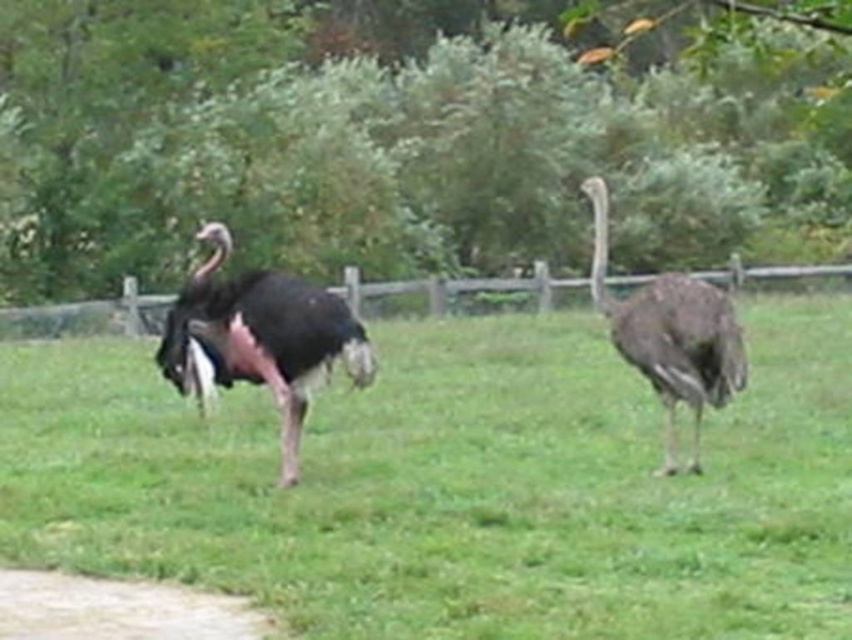
You are an ostrich keeper who needs to walk from the dirt path at lower left to the wooden fence at center. Which path should you take to avoid walking through the enclosure where the ostriches are roaming?

The dirt path at lower left is smaller than the wooden fence at center. To avoid walking through the enclosure, you should take the wooden fence at center as it is larger and likely the designated path for keepers.

You are standing in front of the enclosure with the two ostriches. There are two points marked in the image. You need to determine which point is closer to you. The points are point 1 at coordinates point (104, 580) and point 2 at coordinates point (767, 269). Which point is closer to you?

Point 1 at coordinates point (104, 580) is closer to the viewer than point 2 at coordinates point (767, 269).

You are an ostrich in the enclosure and want to walk to the dirt path at lower left. Which direction should you move from the green grassy at center to reach it?

The dirt path at lower left is located to the left side of the green grassy at center, so you should move towards the left direction from the green grassy at center to reach it.